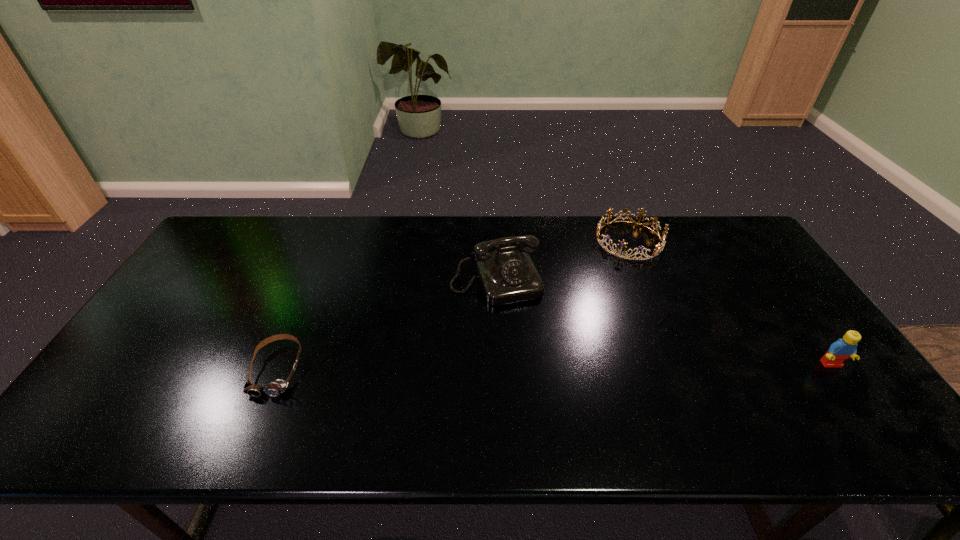
The height and width of the screenshot is (540, 960). In order to click on free area in between the third tallest object and the third object from right to left in this screenshot , I will do `click(563, 261)`.

Point out which object is positioned as the nearest to the goggles. Please provide its 2D coordinates. Your answer should be formatted as a tuple, i.e. [(x, y)], where the tuple contains the x and y coordinates of a point satisfying the conditions above.

[(507, 275)]

Identify which object is located as the third nearest to the third object from right to left. Please provide its 2D coordinates. Your answer should be formatted as a tuple, i.e. [(x, y)], where the tuple contains the x and y coordinates of a point satisfying the conditions above.

[(842, 349)]